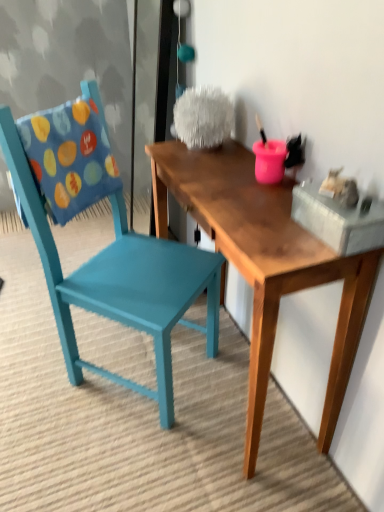
Question: Considering the relative sizes of wooden table at center and blue fabric pillow at left in the image provided, is wooden table at center wider than blue fabric pillow at left?

Choices:
 (A) no
 (B) yes

Answer: (B)

Question: Does wooden table at center come behind blue fabric pillow at left?

Choices:
 (A) yes
 (B) no

Answer: (B)

Question: Does wooden table at center appear on the left side of blue fabric pillow at left?

Choices:
 (A) yes
 (B) no

Answer: (B)

Question: Can you confirm if wooden table at center is thinner than blue fabric pillow at left?

Choices:
 (A) yes
 (B) no

Answer: (B)

Question: Could you tell me if wooden table at center is facing blue fabric pillow at left?

Choices:
 (A) yes
 (B) no

Answer: (A)

Question: Is wooden table at center looking in the opposite direction of blue fabric pillow at left?

Choices:
 (A) yes
 (B) no

Answer: (B)

Question: Does blue fabric pillow at left have a lesser width compared to wooden table at center?

Choices:
 (A) yes
 (B) no

Answer: (A)

Question: Considering the relative positions of blue fabric pillow at left and wooden table at center in the image provided, is blue fabric pillow at left to the left of wooden table at center from the viewer's perspective?

Choices:
 (A) yes
 (B) no

Answer: (A)

Question: From a real-world perspective, is blue fabric pillow at left on wooden table at center?

Choices:
 (A) yes
 (B) no

Answer: (A)

Question: Is the position of blue fabric pillow at left more distant than that of wooden table at center?

Choices:
 (A) no
 (B) yes

Answer: (B)

Question: Does blue fabric pillow at left have a lesser height compared to wooden table at center?

Choices:
 (A) no
 (B) yes

Answer: (B)

Question: Considering the relative sizes of blue fabric pillow at left and wooden table at center in the image provided, is blue fabric pillow at left taller than wooden table at center?

Choices:
 (A) yes
 (B) no

Answer: (B)

Question: Considering the relative positions of wooden table at center and teal painted wood chair at left in the image provided, is wooden table at center in front of teal painted wood chair at left?

Choices:
 (A) no
 (B) yes

Answer: (B)